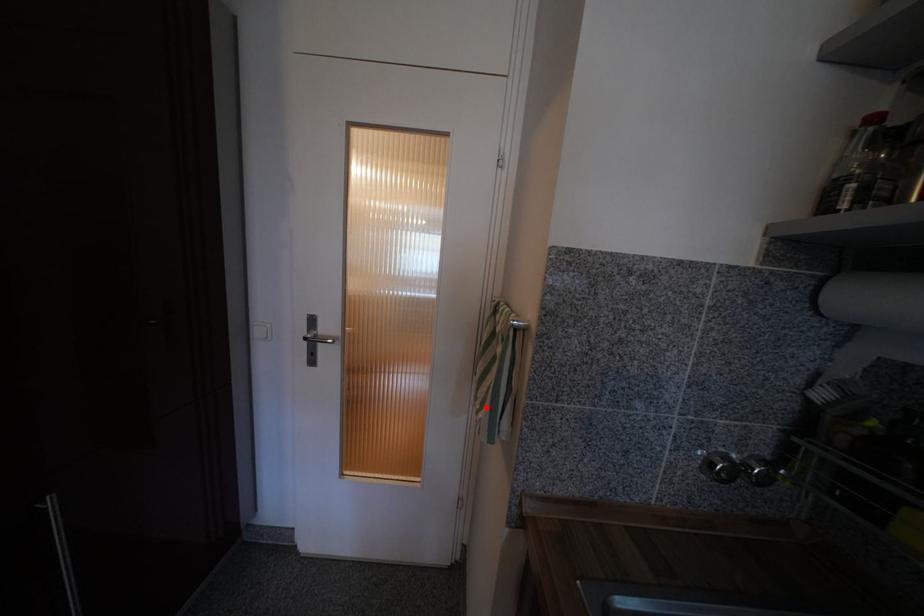
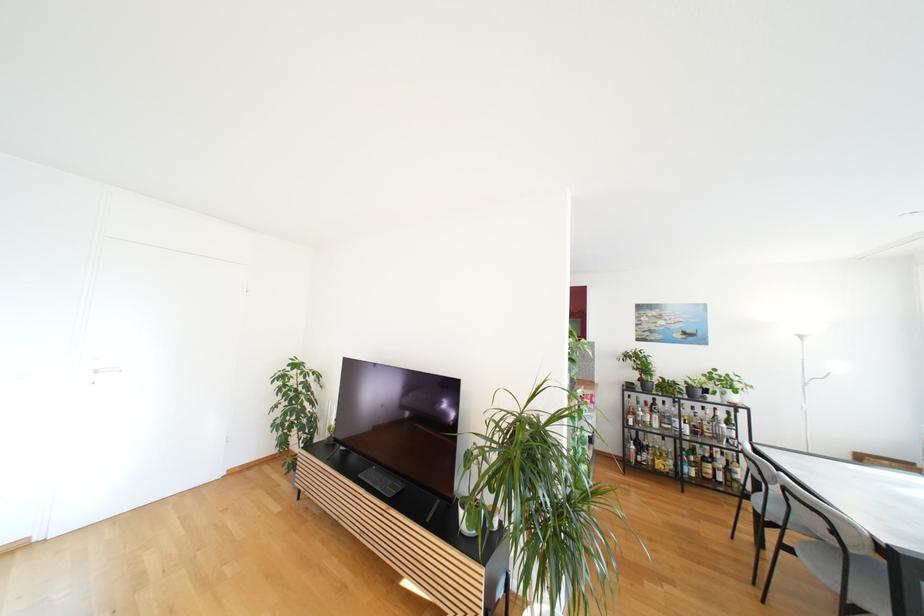
Question: I am providing you with two images of the same scene from different viewpoints. A red point is marked on the first image. At the location where the point appears in image 1, is it still visible in image 2?

Choices:
 (A) Yes
 (B) No

Answer: (B)